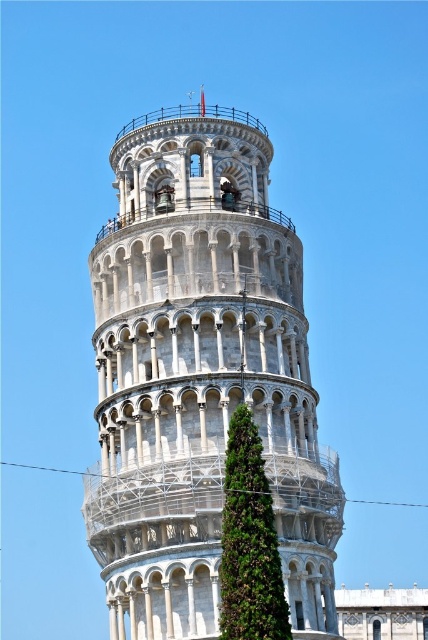
You are a tourist standing at the base of the white stone tower at center and the green leafy tree at center. Which one is taller?

The white stone tower at center is taller than the green leafy tree at center.

You are standing at the base of the Leaning Tower of Pisa and see two points marked on the tower. The first point is at coordinate point(315, 433) and the second is at point(252, 445). If you were to draw a straight line from your current position to each point, which point would require the line to pass closer to the green coniferous tree in front of the tower?

Point(315, 433) is behind point(252, 445). Therefore, the line to point(315, 433) would pass closer to the green coniferous tree in front of the tower since it is further back and might require going around the tree.

You are standing at the base of the white stone tower at center and want to take a photo of it. If you move 50 feet closer to the tower, how far will you be from it?

The white stone tower at center is initially 155.52 feet away. Moving 50 feet closer reduces the distance to 155.52 minus 50, which equals 105.52 feet. Therefore, you will be 105.52 feet away from the white stone tower at center.